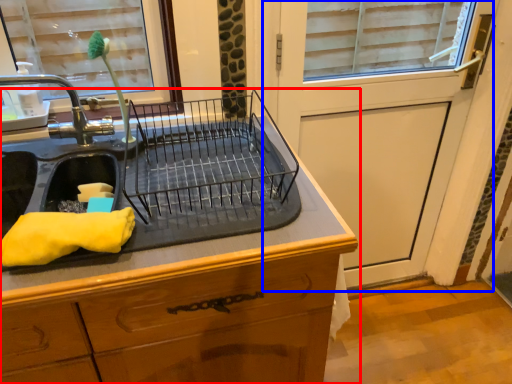
Question: Which object appears farthest to the camera in this image, countertop (highlighted by a red box) or screen door (highlighted by a blue box)?

Choices:
 (A) countertop
 (B) screen door

Answer: (B)